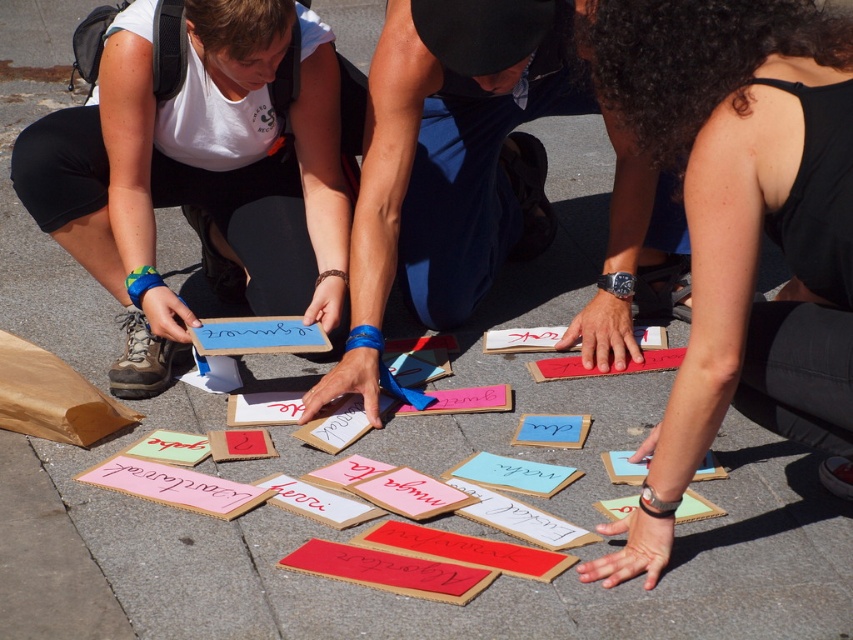
Who is taller, white matte paper at center or cardboard sign at center?

Standing taller between the two is cardboard sign at center.

Who is more distant from viewer, (335, 173) or (612, 305)?

Point (335, 173)

Locate an element on the screen. white matte paper at center is located at coordinates (202, 168).

Which is below, black fabric at center or cardboard sign at center?

Positioned lower is black fabric at center.

Between point (755, 365) and point (392, 76), which one is positioned behind?

Positioned behind is point (392, 76).

Is point (706, 20) closer to camera compared to point (402, 212)?

That is True.

I want to click on black fabric at center, so tap(740, 227).

Is black fabric at center bigger than white matte paper at center?

Actually, black fabric at center might be smaller than white matte paper at center.

Is black fabric at center positioned behind white matte paper at center?

No, black fabric at center is closer to the viewer.

The width and height of the screenshot is (853, 640). Find the location of `black fabric at center`. black fabric at center is located at coordinates (740, 227).